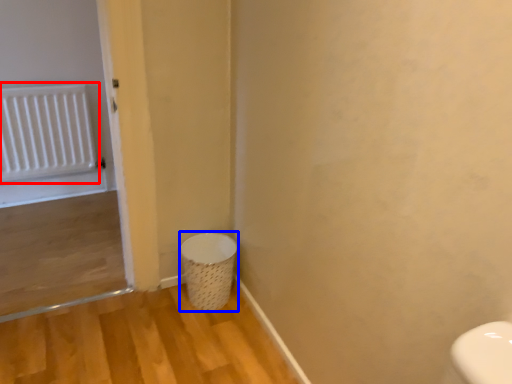
Question: Which of the following is the closest to the observer, radiator (highlighted by a red box) or laundry basket (highlighted by a blue box)?

Choices:
 (A) radiator
 (B) laundry basket

Answer: (B)